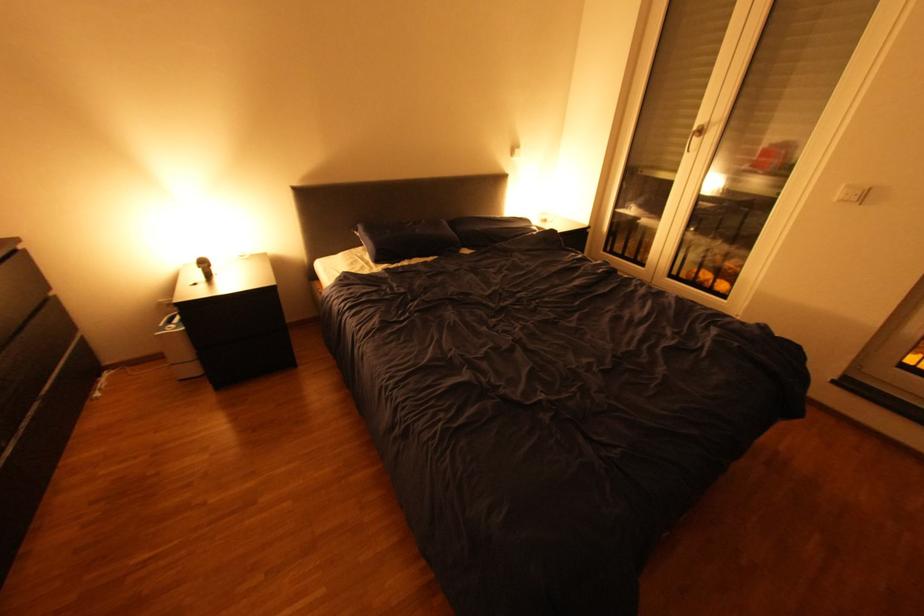
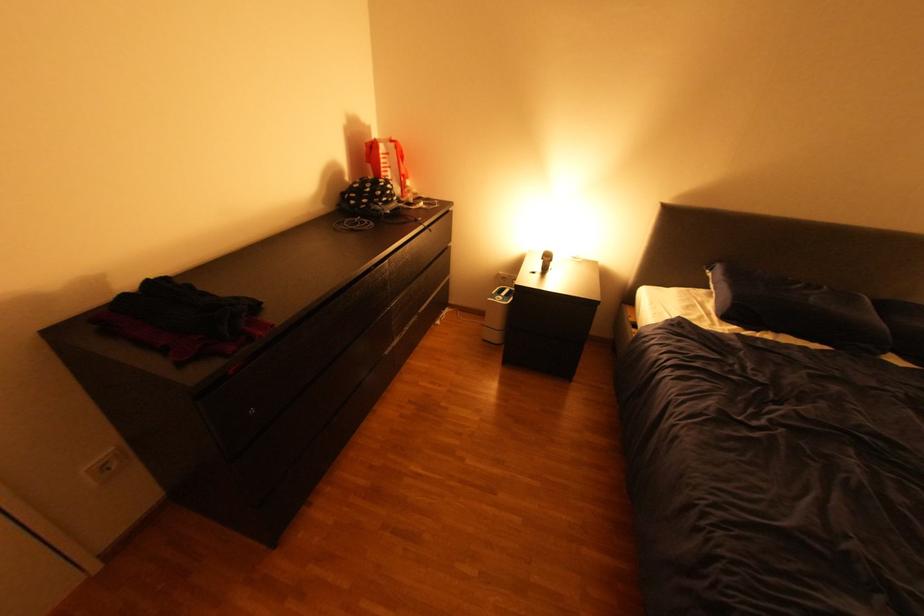
The point at (395, 265) is marked in the first image. Where is the corresponding point in the second image?

(745, 326)